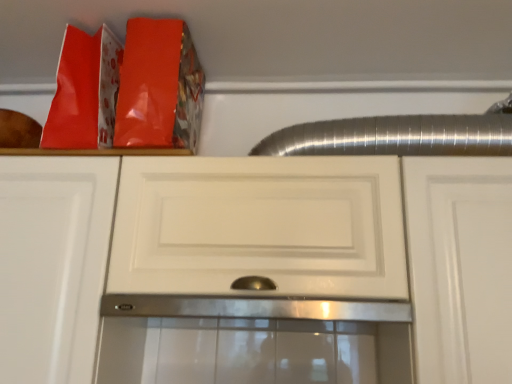
This screenshot has height=384, width=512. Describe the element at coordinates (253, 260) in the screenshot. I see `white matte cabinet at center` at that location.

In order to click on white matte cabinet at center in this screenshot , I will do `click(253, 260)`.

Measure the distance between point (286, 238) and camera.

They are 33.70 inches apart.

Where is `white matte cabinet at center`? white matte cabinet at center is located at coordinates (253, 260).